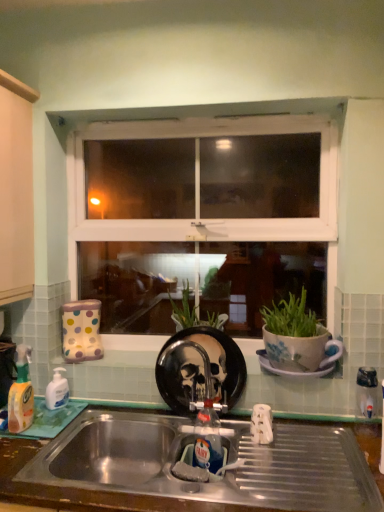
Image resolution: width=384 pixels, height=512 pixels. Identify the location of white opaque plastic bottle at left, arranged as the second bottle when viewed from the front. (57, 390).

The width and height of the screenshot is (384, 512). Identify the location of stainless steel sink at lower center. (228, 461).

What is the approximate width of black glossy plate at center?

The width of black glossy plate at center is 3.01 inches.

Where is `matte wood cabinet at left`? This screenshot has width=384, height=512. matte wood cabinet at left is located at coordinates (16, 190).

Identify the location of metallic faucet at sink center. This screenshot has width=384, height=512. (207, 439).

In terms of width, does white plastic window at center look wider or thinner when compared to matte wood cabinet at left?

Considering their sizes, white plastic window at center looks slimmer than matte wood cabinet at left.

Considering the relative positions of white plastic window at center and matte wood cabinet at left in the image provided, is white plastic window at center to the right of matte wood cabinet at left from the viewer's perspective?

Correct, you'll find white plastic window at center to the right of matte wood cabinet at left.

Measure the distance from white plastic window at center to matte wood cabinet at left.

white plastic window at center and matte wood cabinet at left are 18.89 inches apart.

Choose the correct answer: Is white ceramic saucer at center inside matte wood cabinet at left or outside it?

The correct answer is: outside.

Is white ceramic saucer at center oriented towards matte wood cabinet at left?

No, white ceramic saucer at center is not facing towards matte wood cabinet at left.

Considering the positions of point (295, 372) and point (14, 184), is point (295, 372) closer or farther from the camera than point (14, 184)?

Point (295, 372) is farther from the camera than point (14, 184).

Measure the distance from white ceramic saucer at center to matte wood cabinet at left.

A distance of 3.64 feet exists between white ceramic saucer at center and matte wood cabinet at left.

Looking at this image, which point is more distant from viewer, (236, 122) or (313, 500)?

The point (236, 122) is farther from the camera.

Looking at this image, based on their positions, is white plastic window at center located to the left or right of stainless steel sink at lower center?

Clearly, white plastic window at center is on the left of stainless steel sink at lower center in the image.

Considering the sizes of objects white plastic window at center and stainless steel sink at lower center in the image provided, who is smaller, white plastic window at center or stainless steel sink at lower center?

stainless steel sink at lower center is smaller.

Which is in front, white plastic window at center or stainless steel sink at lower center?

stainless steel sink at lower center is in front.

The width and height of the screenshot is (384, 512). In order to click on window located behind the matte wood cabinet at left in this screenshot , I will do `click(198, 215)`.

Is matte wood cabinet at left oriented towards white plastic window at center?

No.

Which of these two, matte wood cabinet at left or white plastic window at center, is bigger?

Bigger between the two is white plastic window at center.

Is point (21, 293) in front of point (105, 130)?

Yes.

Which of these two, translucent plastic bottle at left, the first bottle from the front, or green leafy plant at center, is bigger?

With larger size is green leafy plant at center.

From the image's perspective, relative to green leafy plant at center, is translucent plastic bottle at left, the first bottle from the front, above or below?

Clearly, from the image's perspective, translucent plastic bottle at left, the first bottle from the front, is below green leafy plant at center.

Is translucent plastic bottle at left, the first bottle from the front, to the left or to the right of green leafy plant at center in the image?

Based on their positions, translucent plastic bottle at left, the first bottle from the front, is located to the left of green leafy plant at center.

From a real-world perspective, who is located lower, translucent plastic bottle at left, which is the second bottle from back to front, or green leafy plant at center?

translucent plastic bottle at left, which is the second bottle from back to front.

Is white plastic window at center facing away from translucent plastic bottle at left, the first bottle from the front?

No, white plastic window at center is not facing the opposite direction of translucent plastic bottle at left, the first bottle from the front.

This screenshot has height=512, width=384. I want to click on window that appears behind the translucent plastic bottle at left, which is the second bottle from back to front, so click(198, 215).

Is white plastic window at center taller than translucent plastic bottle at left, which is the second bottle from back to front?

Yes.

Can you confirm if white plastic window at center is positioned to the left of translucent plastic bottle at left, which is the second bottle from back to front?

No, white plastic window at center is not to the left of translucent plastic bottle at left, which is the second bottle from back to front.

Measure the distance from green leafy plant at center to stainless steel sink at lower center.

A distance of 55.04 centimeters exists between green leafy plant at center and stainless steel sink at lower center.

Which of these two, green leafy plant at center or stainless steel sink at lower center, is bigger?

stainless steel sink at lower center is bigger.

At what (x,y) coordinates should I click in order to perform the action: click on sink that appears below the green leafy plant at center (from a real-world perspective). Please return your answer as a coordinate pair (x, y). Looking at the image, I should click on (228, 461).

Locate an element on the screen. The width and height of the screenshot is (384, 512). cabinetry located above the white plastic window at center (from a real-world perspective) is located at coordinates [16, 190].

I want to click on saucer located on the right of matte wood cabinet at left, so click(292, 368).

Estimate the real-world distances between objects in this image. Which object is further from white opaque plastic bottle at left, arranged as the second bottle when viewed from the front, translucent plastic bottle at left, the first bottle from the front, or black glossy plate at center?

black glossy plate at center lies further to white opaque plastic bottle at left, arranged as the second bottle when viewed from the front, than the other object.

Considering their positions, is matte wood cabinet at left positioned further to white opaque plastic bottle at left, arranged as the second bottle when viewed from the front, than white plastic window at center?

The object further to white opaque plastic bottle at left, arranged as the second bottle when viewed from the front, is white plastic window at center.

From the image, which object appears to be farther from green leafy plant at center, stainless steel sink at lower center or translucent plastic bottle at left, the first bottle from the front?

The object further to green leafy plant at center is translucent plastic bottle at left, the first bottle from the front.

Which object lies further to the anchor point matte wood cabinet at left, white opaque plastic bottle at left, arranged as the second bottle when viewed from the front, or white ceramic saucer at center?

white ceramic saucer at center.

Estimate the real-world distances between objects in this image. Which object is further from stainless steel sink at lower center, metallic faucet at sink center or black glossy plate at center?

Among the two, black glossy plate at center is located further to stainless steel sink at lower center.

From the image, which object appears to be farther from black glossy plate at center, green leafy plant at center or stainless steel sink at lower center?

stainless steel sink at lower center lies further to black glossy plate at center than the other object.

Estimate the real-world distances between objects in this image. Which object is closer to matte wood cabinet at left, metallic faucet at sink center or green leafy plant at center?

green leafy plant at center lies closer to matte wood cabinet at left than the other object.

Considering their positions, is translucent plastic bottle at left, the first bottle from the front, positioned closer to black glossy plate at center than stainless steel sink at lower center?

Based on the image, stainless steel sink at lower center appears to be nearer to black glossy plate at center.

The height and width of the screenshot is (512, 384). Identify the location of appliance between white plastic window at center and metallic faucet at sink center vertically. coord(200,368).

Locate an element on the screen. tap between white plastic window at center and stainless steel sink at lower center vertically is located at coordinates (207, 439).

Identify the location of houseplant between matte wood cabinet at left and stainless steel sink at lower center in the up-down direction. Image resolution: width=384 pixels, height=512 pixels. (193, 313).

The image size is (384, 512). I want to click on appliance located between matte wood cabinet at left and white ceramic saucer at center in the left-right direction, so click(x=200, y=368).